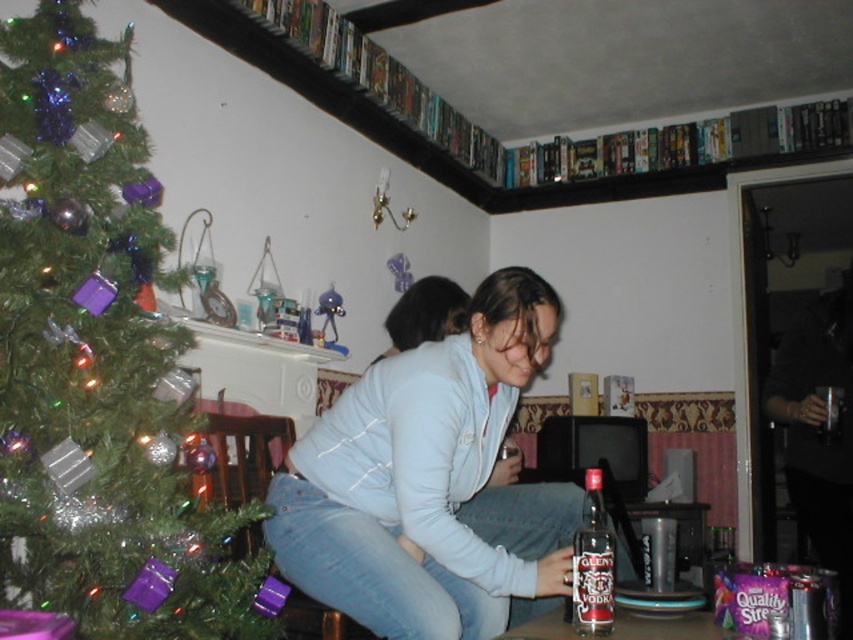
Question: Does green matte christmas tree at left come in front of light blue denim jeans at center?

Choices:
 (A) no
 (B) yes

Answer: (B)

Question: Among these objects, which one is farthest from the camera?

Choices:
 (A) clear glass bottle of glenlivet vodka at lower center
 (B) light blue denim jeans at center
 (C) green matte christmas tree at left

Answer: (B)

Question: Which of the following is the closest to the observer?

Choices:
 (A) light blue denim jeans at center
 (B) clear glass bottle of glenlivet vodka at lower center

Answer: (B)

Question: Does light blue denim jeans at center have a smaller size compared to clear glass bottle of glenlivet vodka at lower center?

Choices:
 (A) no
 (B) yes

Answer: (A)

Question: Among these points, which one is farthest from the camera?

Choices:
 (A) (596, 520)
 (B) (386, 492)
 (C) (45, 308)

Answer: (B)

Question: Can you confirm if green matte christmas tree at left is thinner than clear glass bottle of glenlivet vodka at lower center?

Choices:
 (A) yes
 (B) no

Answer: (B)